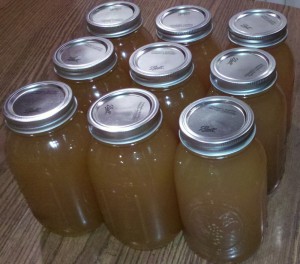
Find the location of a particular element. The image size is (300, 264). rightmost jar is located at coordinates (286, 66).